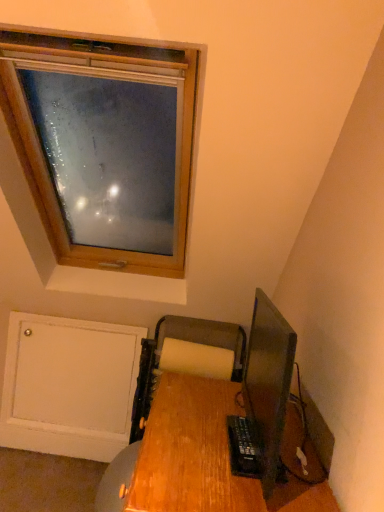
Question: Is wooden desk at lower right touching wooden printer at lower center?

Choices:
 (A) yes
 (B) no

Answer: (B)

Question: Can you confirm if wooden desk at lower right is thinner than wooden printer at lower center?

Choices:
 (A) yes
 (B) no

Answer: (B)

Question: Can you confirm if wooden desk at lower right is positioned to the left of wooden printer at lower center?

Choices:
 (A) yes
 (B) no

Answer: (B)

Question: From a real-world perspective, is wooden desk at lower right below wooden printer at lower center?

Choices:
 (A) no
 (B) yes

Answer: (A)

Question: From a real-world perspective, is wooden desk at lower right over wooden printer at lower center?

Choices:
 (A) no
 (B) yes

Answer: (B)

Question: From a real-world perspective, is wooden printer at lower center positioned above or below wooden desk at lower right?

Choices:
 (A) below
 (B) above

Answer: (A)

Question: Considering the positions of wooden printer at lower center and wooden desk at lower right in the image, is wooden printer at lower center wider or thinner than wooden desk at lower right?

Choices:
 (A) wide
 (B) thin

Answer: (B)

Question: Which is correct: wooden printer at lower center is inside wooden desk at lower right, or outside of it?

Choices:
 (A) outside
 (B) inside

Answer: (A)

Question: Based on their positions, is wooden printer at lower center located to the left or right of wooden desk at lower right?

Choices:
 (A) right
 (B) left

Answer: (B)

Question: Would you say matte black monitor at lower right is inside or outside wooden desk at lower right?

Choices:
 (A) inside
 (B) outside

Answer: (B)

Question: From the image's perspective, is matte black monitor at lower right above or below wooden desk at lower right?

Choices:
 (A) above
 (B) below

Answer: (A)

Question: Is matte black monitor at lower right bigger or smaller than wooden desk at lower right?

Choices:
 (A) small
 (B) big

Answer: (A)

Question: Is point (253, 385) positioned closer to the camera than point (190, 444)?

Choices:
 (A) farther
 (B) closer

Answer: (A)

Question: In terms of height, does wooden printer at lower center look taller or shorter compared to matte black monitor at lower right?

Choices:
 (A) short
 (B) tall

Answer: (B)

Question: Based on their positions, is wooden printer at lower center located to the left or right of matte black monitor at lower right?

Choices:
 (A) left
 (B) right

Answer: (A)